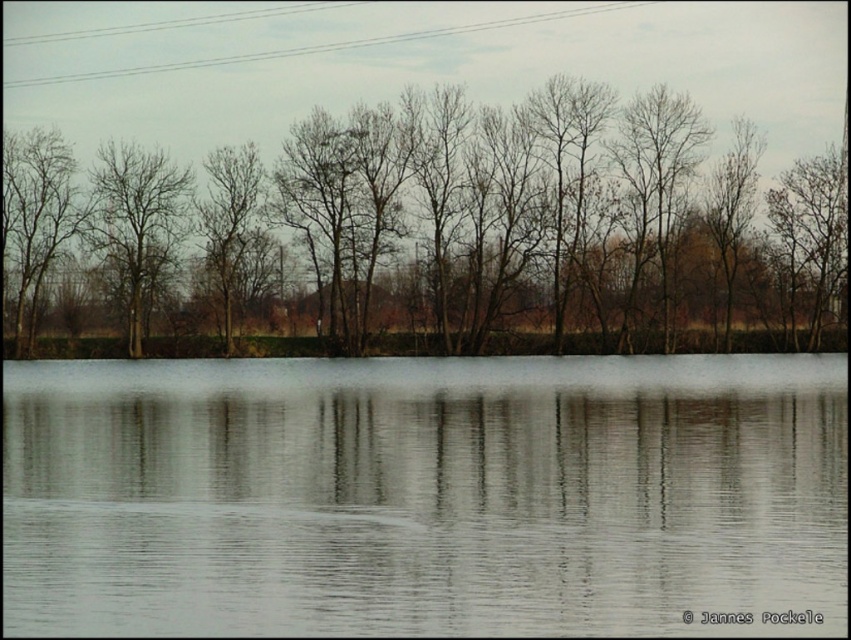
You are an artist trying to paint the scene. You notice two sets of bare branches in the image. Which set, the bare branches at center or the bare branches at left, appears bigger in the painting?

The bare branches at center appears bigger in the painting because it has a larger size compared to the bare branches at left.

You are an observer standing at the edge of the transparent water at center. You notice the bare branches at left in the distance. Which object appears closer to you in the scene?

The transparent water at center appears closer to you because it is shorter than the bare branches at left, indicating it is positioned nearer in the visual plane.